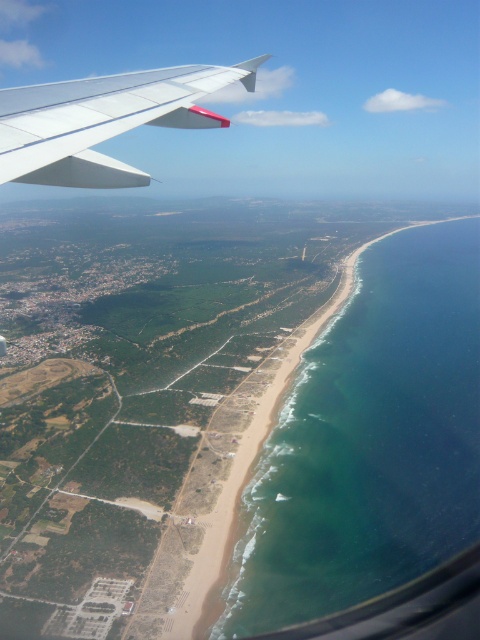
Question: Which point is farther from the camera taking this photo?

Choices:
 (A) (68, 97)
 (B) (465, 308)

Answer: (B)

Question: Does green water at beach right appear under white matte wing at upper left?

Choices:
 (A) yes
 (B) no

Answer: (A)

Question: Does green water at beach right have a lesser width compared to white matte wing at upper left?

Choices:
 (A) no
 (B) yes

Answer: (A)

Question: Is green water at beach right thinner than white matte wing at upper left?

Choices:
 (A) no
 (B) yes

Answer: (A)